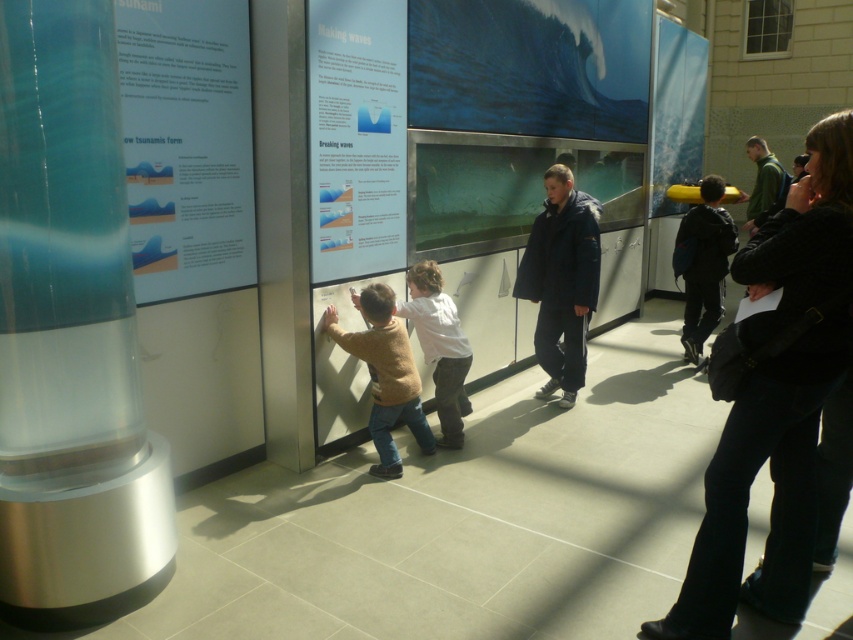
You are a museum visitor who wants to take a photo of the transparent glass cylinder at left without the white cotton shirt at center blocking the view. Can you do that?

The transparent glass cylinder at left is much taller than the white cotton shirt at center, so you can take a photo of the transparent glass cylinder at left without the white cotton shirt at center blocking the view by positioning yourself higher or angling the camera upwards.

You are a tour guide leading a group through the museum. You notice two points marked on the floor at coordinates point (113,355) and point (688,289). Which point should you stand at if you want to be closer to the entrance located behind the wall where the children are interacting?

You should stand at point (113,355) because it is in front of point (688,289), making it closer to the entrance behind the wall where the children are interacting.